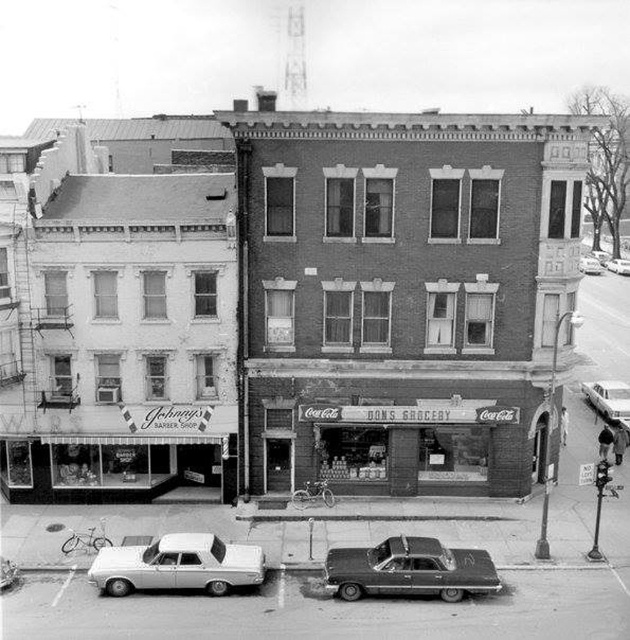
Question: Can you confirm if shiny black car at center is positioned above white glossy sedan at center?

Choices:
 (A) yes
 (B) no

Answer: (B)

Question: Among these objects, which one is nearest to the camera?

Choices:
 (A) shiny black car at center
 (B) brick facade store at center

Answer: (A)

Question: Does brick facade store at center have a greater width compared to metallic silver car at center?

Choices:
 (A) yes
 (B) no

Answer: (B)

Question: From the image, what is the correct spatial relationship of brick facade store at center in relation to white matte sedan at center?

Choices:
 (A) below
 (B) above

Answer: (A)

Question: Which object is the closest to the metallic silver car at center?

Choices:
 (A) silver metallic sedan at lower center
 (B) shiny black car at center
 (C) brick facade store at center

Answer: (C)

Question: Which point is farther from the camera taking this photo?

Choices:
 (A) (386, 323)
 (B) (609, 413)
 (C) (619, 272)
 (D) (595, 272)

Answer: (C)